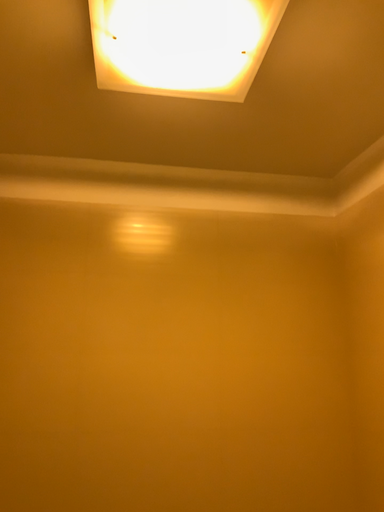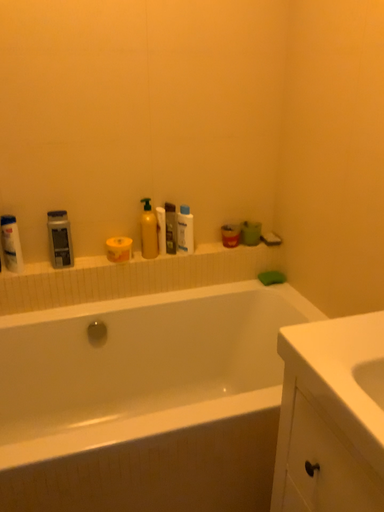
Question: Which way did the camera rotate in the video?

Choices:
 (A) rotated downward
 (B) rotated upward

Answer: (A)